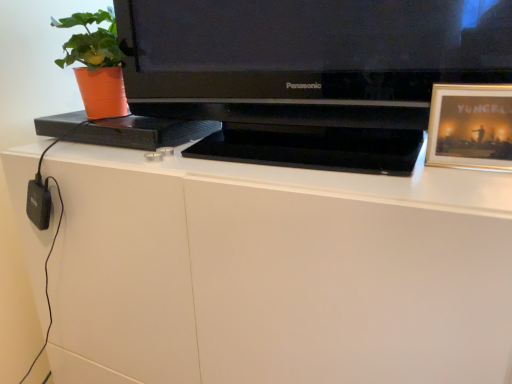
Question: Is point (500, 23) positioned closer to the camera than point (420, 311)?

Choices:
 (A) farther
 (B) closer

Answer: (A)

Question: Based on their sizes in the image, would you say black glossy television at center is bigger or smaller than white matte desk at center?

Choices:
 (A) small
 (B) big

Answer: (A)

Question: Which is farther from the black glossy television at center?

Choices:
 (A) orange plastic pot at left
 (B) gold-framed picture at upper right
 (C) white matte desk at center

Answer: (A)

Question: Which object is positioned closest to the orange plastic pot at left?

Choices:
 (A) black glossy television at center
 (B) gold-framed picture at upper right
 (C) white matte desk at center

Answer: (A)